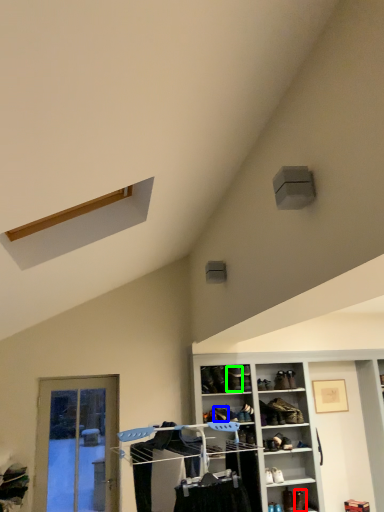
Question: Which object is the closest to the shoe (highlighted by a red box)? Choose among these: shoe (highlighted by a blue box) or shoe (highlighted by a green box).

Choices:
 (A) shoe
 (B) shoe

Answer: (A)